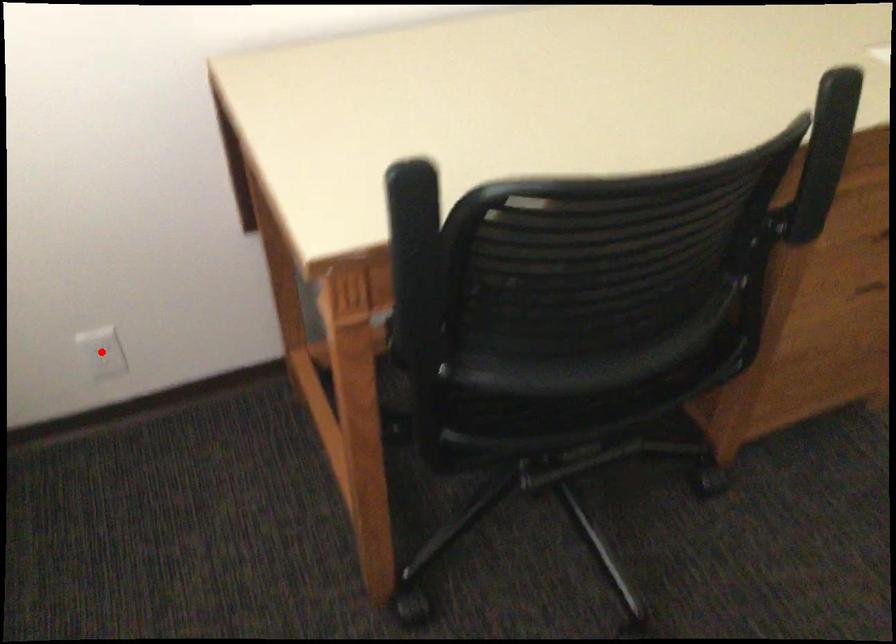
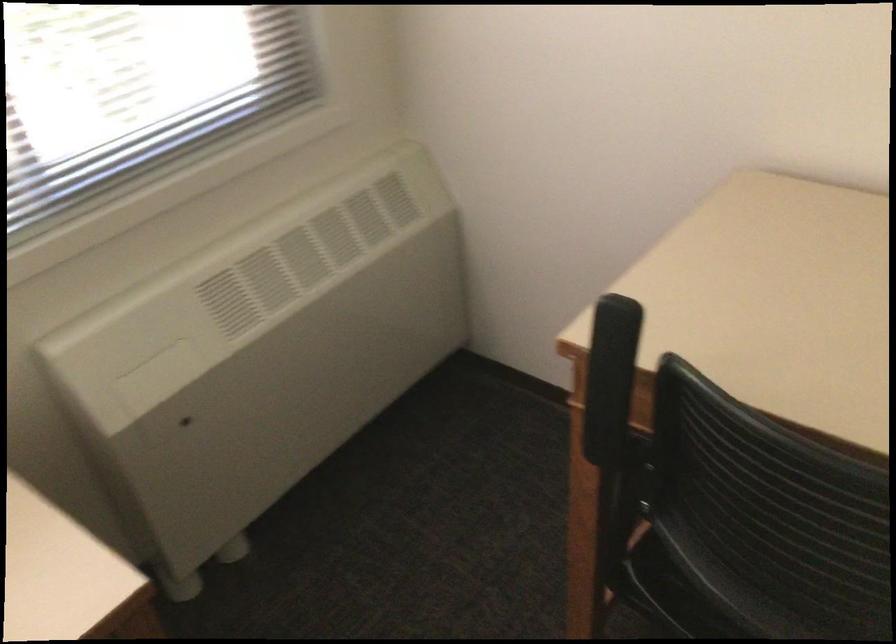
Question: I am providing you with two images of the same scene from different viewpoints. A red point is marked on the first image. Is the red point's position out of view in image 2?

Choices:
 (A) Yes
 (B) No

Answer: (A)